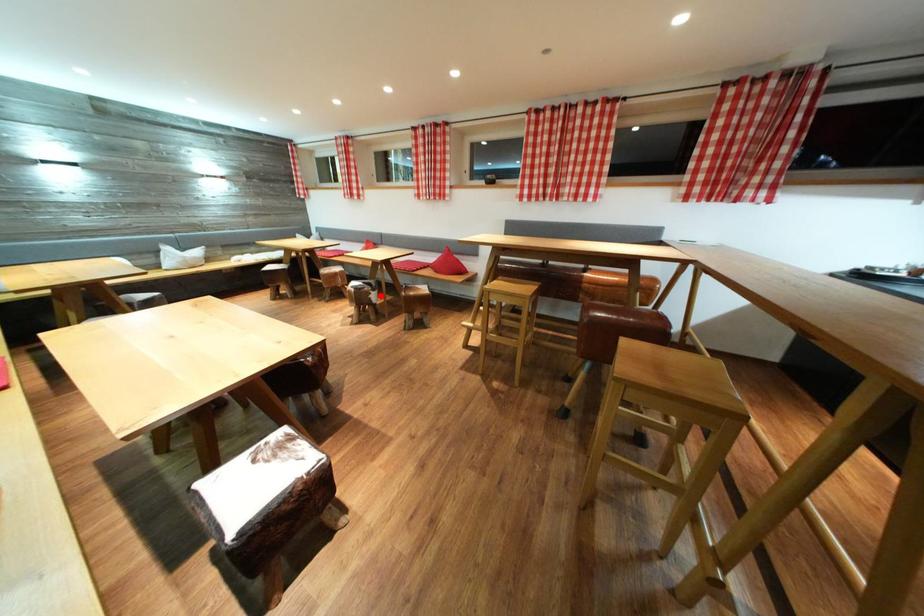
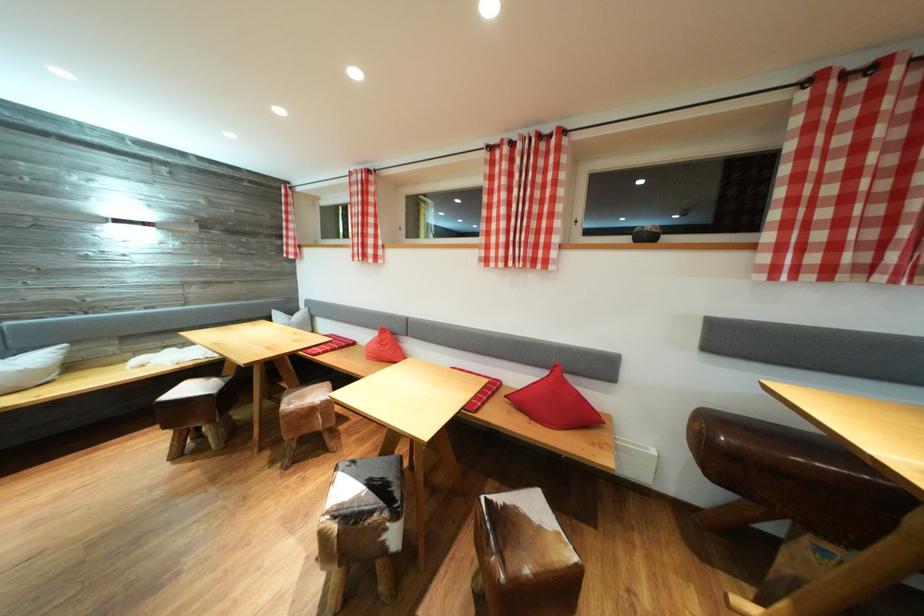
Question: I am providing you with two images of the same scene from different viewpoints. Given a red point in image1, look at the same physical point in image2. Is it:

Choices:
 (A) Closer to the viewpoint
 (B) Farther from the viewpoint

Answer: (B)